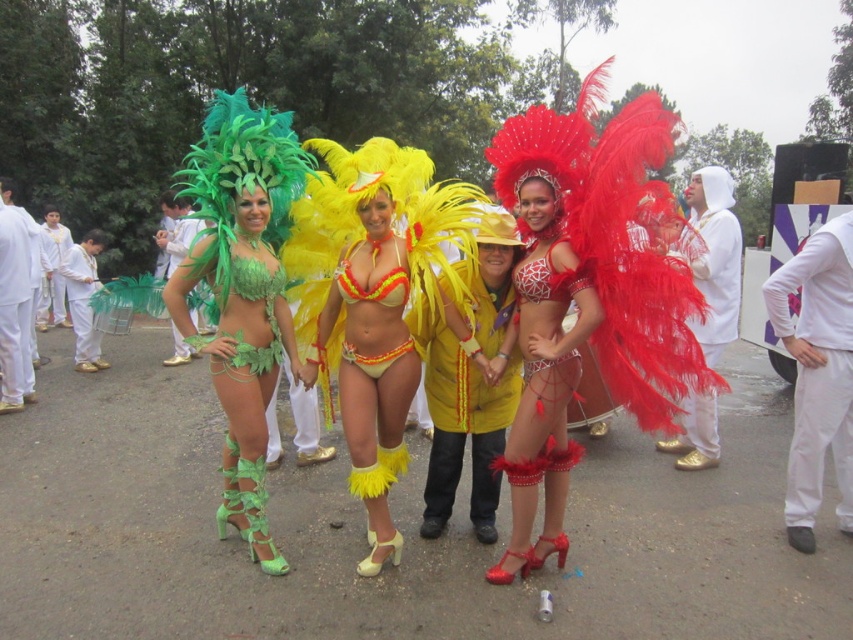
Question: Can you confirm if yellow feathered bikini at center is positioned to the right of shiny red feathers at center?

Choices:
 (A) no
 (B) yes

Answer: (A)

Question: Does yellow feathered bikini at center appear on the right side of shiny red feathers at center?

Choices:
 (A) yes
 (B) no

Answer: (B)

Question: Which object is farther from the camera taking this photo?

Choices:
 (A) yellow feathered bikini at center
 (B) green matte bikini at left
 (C) white matte pants at right
 (D) shiny red feathers at center

Answer: (C)

Question: Which point is farther to the camera?

Choices:
 (A) shiny red feathers at center
 (B) yellow feathered bikini at center
 (C) green matte bikini at left
 (D) matte green fabric bikini at center

Answer: (D)

Question: Does white matte pants at right appear under matte green fabric bikini at center?

Choices:
 (A) no
 (B) yes

Answer: (B)

Question: Which point is closer to the camera?

Choices:
 (A) (820, 428)
 (B) (561, 404)

Answer: (B)